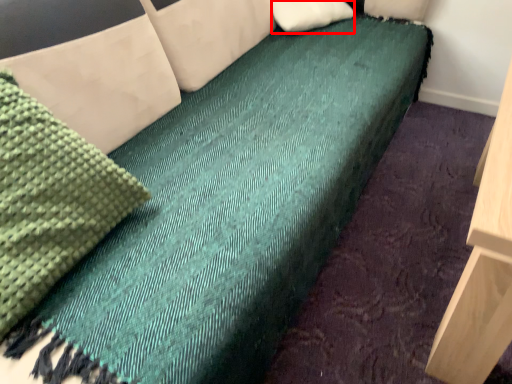
Question: From the image, what is the correct spatial relationship of pillow (annotated by the red box) in relation to material?

Choices:
 (A) left
 (B) right

Answer: (B)